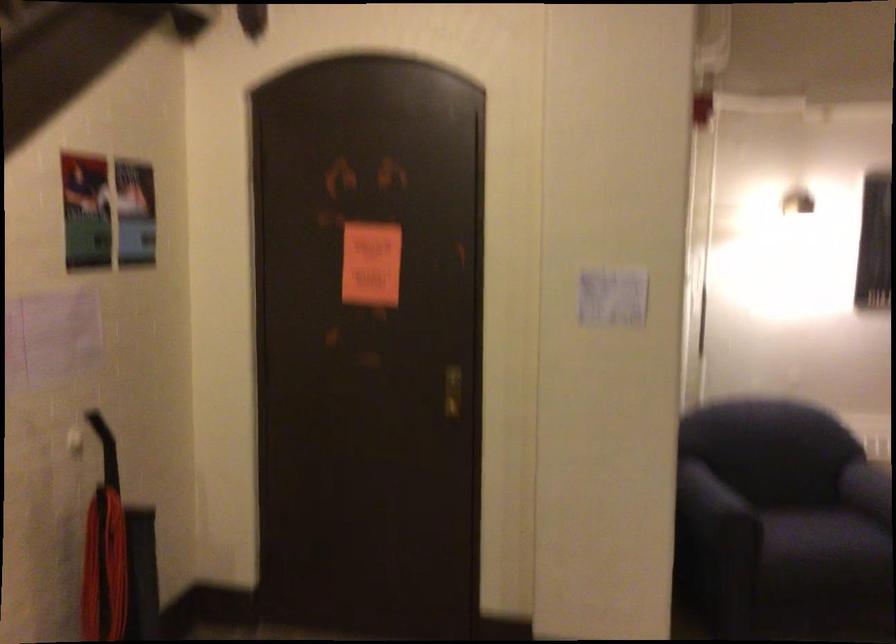
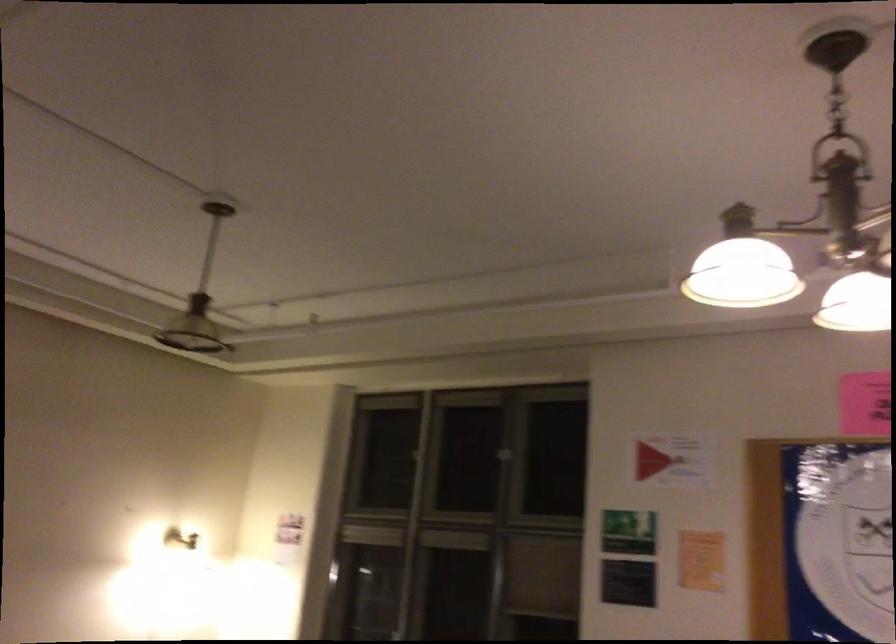
Looking at this image, based on the continuous images, in which direction is the camera rotating?

The camera's rotation is toward right-up.